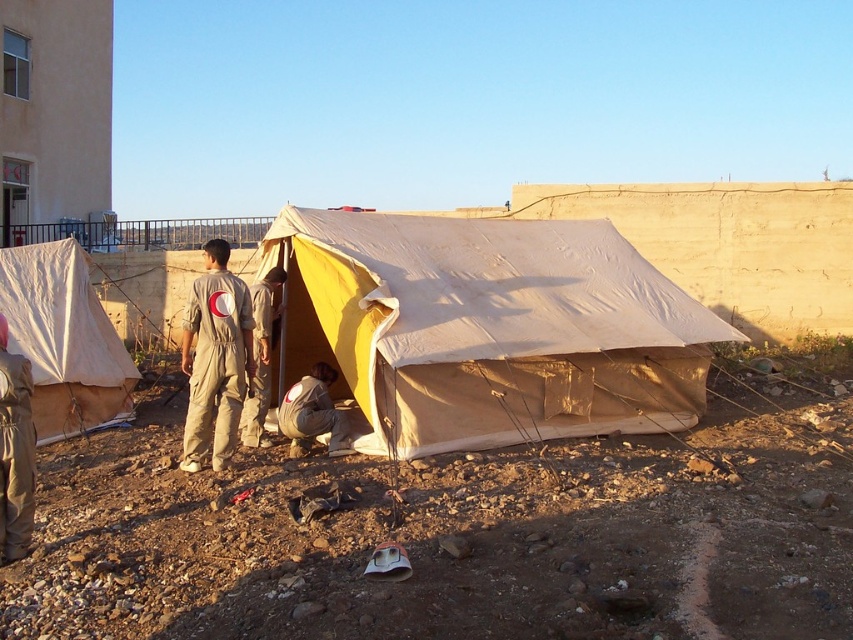
You are standing 5 meters away from the beige canvas tent at center. Can you safely walk towards it without getting too close?

The beige canvas tent at center is 6.32 meters away from the camera, so if you are standing 5 meters away from it, you are already closer than the camera. Therefore, you are already within 5 meters and may need to adjust your position to maintain a safe distance.

You are a photographer positioned at the back of the scene. You want to take a photo of the khaki uniform at center without the beige canvas tent at center blocking it. Is this possible?

The beige canvas tent at center is in front of the khaki uniform at center, so it would block the view. Move to a position where the tent is not between you and the khaki uniform at center.